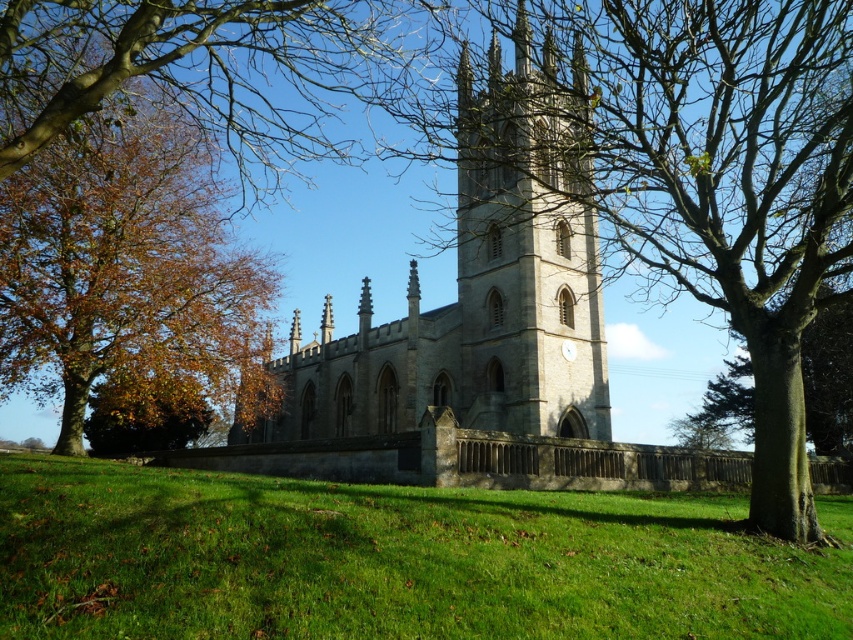
Question: Which point is farther to the camera?

Choices:
 (A) autumn leaves at left
 (B) bare wood tree at center

Answer: (A)

Question: Which point is farther to the camera?

Choices:
 (A) bare wood tree at center
 (B) stone clock tower at center
 (C) light gray stone church at center

Answer: (C)

Question: Among these points, which one is nearest to the camera?

Choices:
 (A) (585, 564)
 (B) (584, 305)

Answer: (A)

Question: Does green grass at lower center appear on the right side of autumn leaves at left?

Choices:
 (A) yes
 (B) no

Answer: (A)

Question: Is bare wood tree at center wider than stone clock tower at center?

Choices:
 (A) no
 (B) yes

Answer: (B)

Question: Does bare wood tree at center appear on the right side of light gray stone church at center?

Choices:
 (A) yes
 (B) no

Answer: (A)